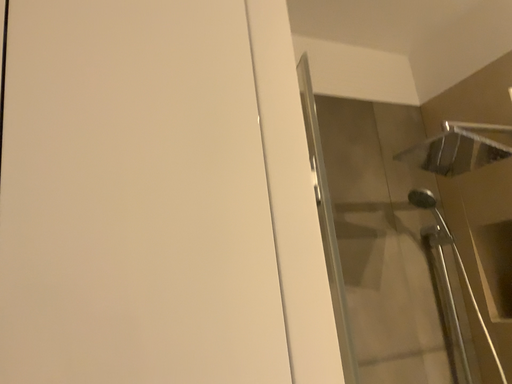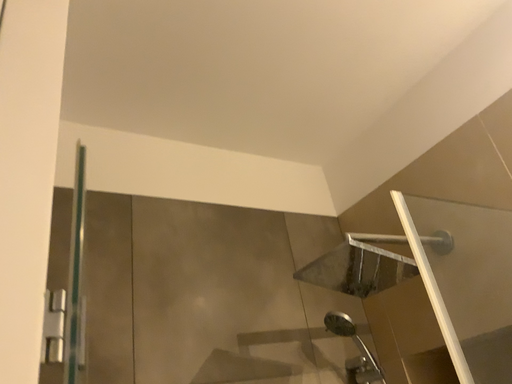
Question: How did the camera likely rotate when shooting the video?

Choices:
 (A) rotated downward
 (B) rotated upward

Answer: (B)